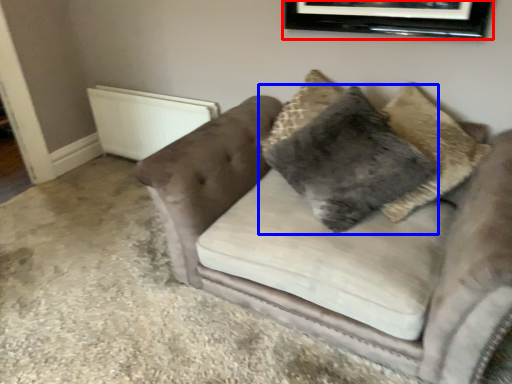
Question: Which object is further to the camera taking this photo, picture frame (highlighted by a red box) or pillow (highlighted by a blue box)?

Choices:
 (A) picture frame
 (B) pillow

Answer: (A)